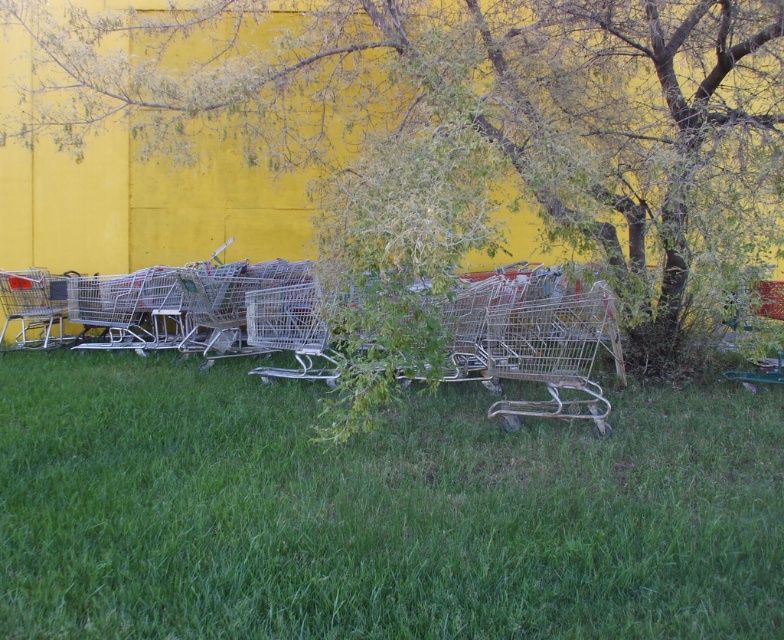
Who is more forward, (581, 340) or (782, 289)?

Point (581, 340) is more forward.

Which is behind, point (572, 364) or point (775, 381)?

The point (775, 381) is behind.

At what (x,y) coordinates should I click in order to perform the action: click on metallic silver shopping cart at center. Please return your answer as a coordinate pair (x, y). The image size is (784, 640). Looking at the image, I should click on (554, 355).

Describe the element at coordinates (376, 509) in the screenshot. I see `green grass at lower center` at that location.

Is green grass at lower center in front of metallic silver shopping cart at right?

Yes, green grass at lower center is closer to the viewer.

Is point (512, 528) less distant than point (746, 371)?

Yes, point (512, 528) is closer to viewer.

Find the location of `green grass at lower center`. green grass at lower center is located at coordinates (376, 509).

This screenshot has width=784, height=640. In order to click on green leafy tree at center in this screenshot , I will do `click(470, 109)`.

Between green leafy tree at center and metallic silver shopping cart at center, which one appears on the right side from the viewer's perspective?

metallic silver shopping cart at center

The image size is (784, 640). In order to click on green leafy tree at center in this screenshot , I will do `click(470, 109)`.

Locate an element on the screen. The height and width of the screenshot is (640, 784). green leafy tree at center is located at coordinates (470, 109).